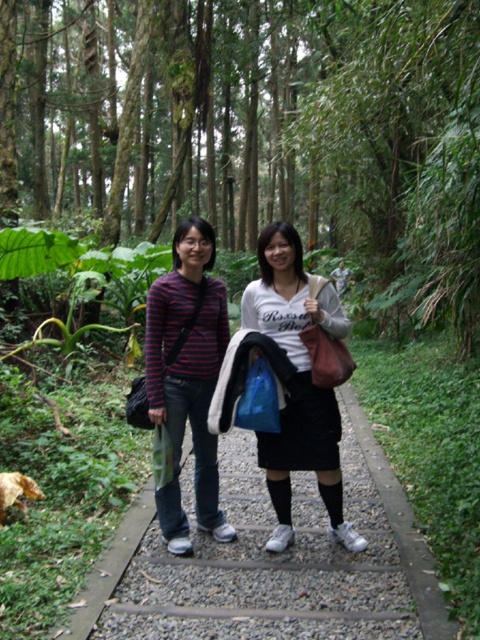
Question: Is green leafy tree at center above striped cotton shirt at center?

Choices:
 (A) yes
 (B) no

Answer: (A)

Question: Which object is positioned closest to the green leafy tree at center?

Choices:
 (A) striped cotton shirt at center
 (B) white matte skirt at center

Answer: (A)

Question: Which of the following is the farthest from the observer?

Choices:
 (A) gravel path at center
 (B) striped cotton shirt at center

Answer: (B)

Question: Which point is closer to the camera?

Choices:
 (A) (212, 486)
 (B) (245, 291)
 (C) (374, 609)

Answer: (C)

Question: Can you confirm if green leafy tree at center is thinner than gravel path at center?

Choices:
 (A) no
 (B) yes

Answer: (A)

Question: Is green leafy tree at center in front of gravel path at center?

Choices:
 (A) no
 (B) yes

Answer: (A)